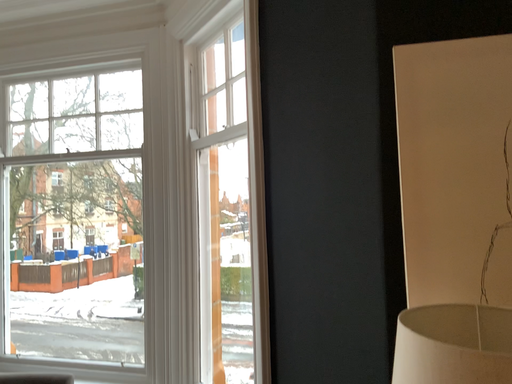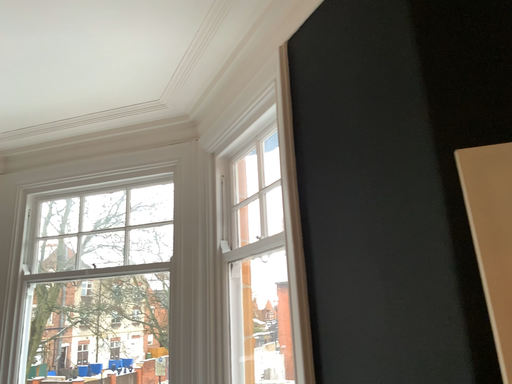
Question: How did the camera likely rotate when shooting the video?

Choices:
 (A) rotated downward
 (B) rotated upward

Answer: (B)